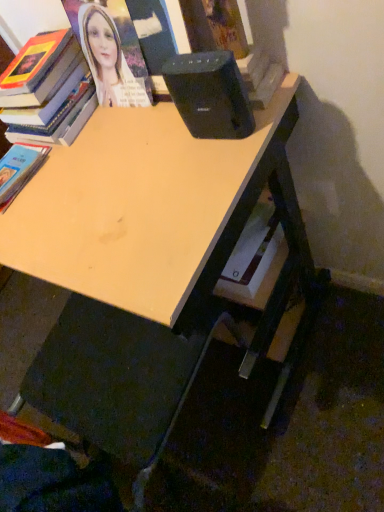
Question: Is black plastic speaker at upper center not close to hardcover book at lower left, acting as the 1th book starting from the bottom?

Choices:
 (A) yes
 (B) no

Answer: (B)

Question: Is black plastic speaker at upper center located outside hardcover book at lower left, marked as the second book in a top-to-bottom arrangement?

Choices:
 (A) yes
 (B) no

Answer: (A)

Question: Can you confirm if black plastic speaker at upper center is shorter than hardcover book at lower left, marked as the second book in a top-to-bottom arrangement?

Choices:
 (A) yes
 (B) no

Answer: (B)

Question: Does black plastic speaker at upper center have a greater height compared to hardcover book at lower left, acting as the 1th book starting from the bottom?

Choices:
 (A) no
 (B) yes

Answer: (B)

Question: Is hardcover book at lower left, marked as the second book in a top-to-bottom arrangement, at the back of black plastic speaker at upper center?

Choices:
 (A) no
 (B) yes

Answer: (A)

Question: Based on their sizes in the image, would you say black plastic speaker at upper center is bigger or smaller than light wood desk at center?

Choices:
 (A) small
 (B) big

Answer: (A)

Question: From a real-world perspective, is black plastic speaker at upper center physically located above or below light wood desk at center?

Choices:
 (A) below
 (B) above

Answer: (B)

Question: In the image, is black plastic speaker at upper center positioned in front of or behind light wood desk at center?

Choices:
 (A) front
 (B) behind

Answer: (B)

Question: Looking at their shapes, would you say black plastic speaker at upper center is wider or thinner than light wood desk at center?

Choices:
 (A) thin
 (B) wide

Answer: (A)

Question: Is point (34, 163) positioned closer to the camera than point (62, 67)?

Choices:
 (A) farther
 (B) closer

Answer: (B)

Question: From their relative heights in the image, would you say hardcover book at lower left, marked as the second book in a top-to-bottom arrangement, is taller or shorter than hardcover book at upper left, which is the first book from top to bottom?

Choices:
 (A) tall
 (B) short

Answer: (B)

Question: Looking at their shapes, would you say hardcover book at lower left, marked as the second book in a top-to-bottom arrangement, is wider or thinner than hardcover book at upper left, which is the first book from top to bottom?

Choices:
 (A) wide
 (B) thin

Answer: (B)

Question: From a real-world perspective, is hardcover book at lower left, marked as the second book in a top-to-bottom arrangement, physically located above or below hardcover book at upper left, which is the 2th book in bottom-to-top order?

Choices:
 (A) above
 (B) below

Answer: (B)

Question: Would you say hardcover book at upper left, which is the first book from top to bottom, is inside or outside black plastic speaker at upper center?

Choices:
 (A) outside
 (B) inside

Answer: (A)

Question: Is hardcover book at upper left, which is the 2th book in bottom-to-top order, wider or thinner than black plastic speaker at upper center?

Choices:
 (A) wide
 (B) thin

Answer: (A)